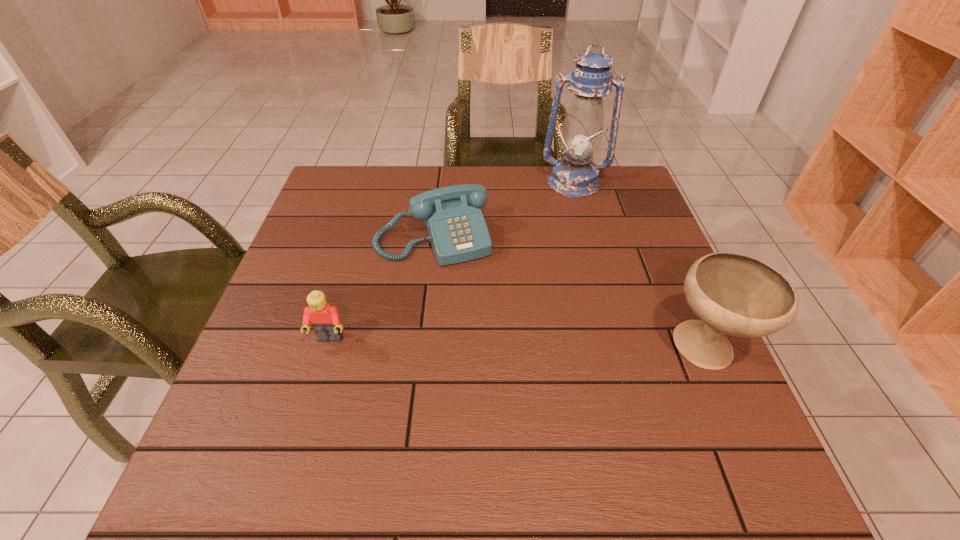
This screenshot has height=540, width=960. In order to click on vacant area at the near edge in this screenshot , I will do `click(513, 410)`.

The image size is (960, 540). What are the coordinates of `free space at the left edge` in the screenshot? It's located at (296, 358).

Image resolution: width=960 pixels, height=540 pixels. I want to click on vacant space at the right edge of the desktop, so click(x=667, y=280).

In order to click on free space at the far left corner of the desktop in this screenshot , I will do `click(356, 181)`.

Where is `free space at the near right corner of the desktop`? Image resolution: width=960 pixels, height=540 pixels. free space at the near right corner of the desktop is located at coordinates (713, 434).

This screenshot has width=960, height=540. What are the coordinates of `blank region between the lantern and the third shortest object` in the screenshot? It's located at (639, 266).

The height and width of the screenshot is (540, 960). In order to click on vacant space that is in between the Lego and the second farthest object in this screenshot , I will do `click(381, 288)`.

Identify the location of vacant point located between the third nearest object and the lantern. The height and width of the screenshot is (540, 960). (503, 210).

Where is `free space between the chalice and the third nearest object`? This screenshot has height=540, width=960. free space between the chalice and the third nearest object is located at coordinates (569, 293).

Where is `empty space that is in between the third shortest object and the Lego`? empty space that is in between the third shortest object and the Lego is located at coordinates (517, 344).